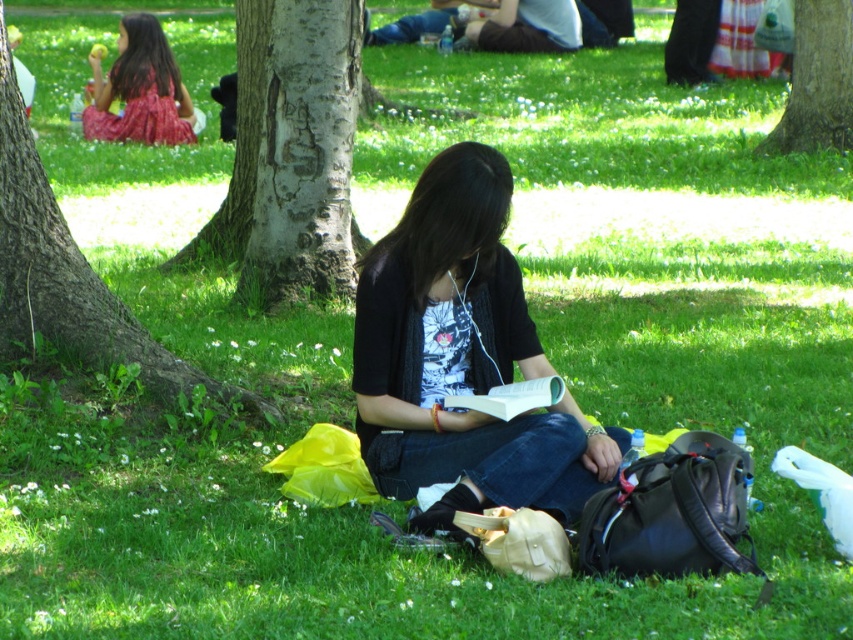
You are a photographer trying to capture a closeup of the white paper book at center. To avoid including the smooth gray bark at lower left in your shot, should you move the camera upwards or downwards?

The smooth gray bark at lower left is located above the white paper book at center. To avoid including it in your shot, you should move the camera downwards.

You are a park visitor who wants to determine which tree has a thicker trunk between the smooth gray bark at center and the smooth bark tree at upper right. Based on the scene, which one is thicker?

The smooth gray bark at center is thinner than the smooth bark tree at upper right, so the smooth bark tree at upper right has a thicker trunk.